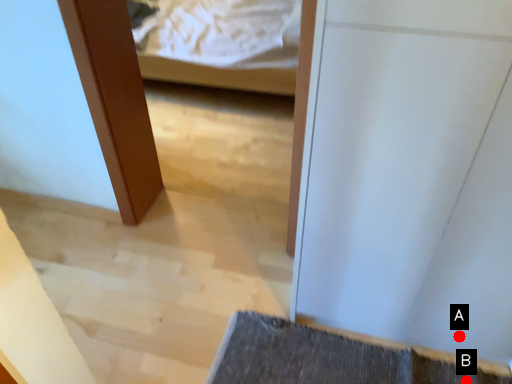
Question: Two points are circled on the image, labeled by A and B beside each circle. Which point is closer to the camera?

Choices:
 (A) A is closer
 (B) B is closer

Answer: (A)